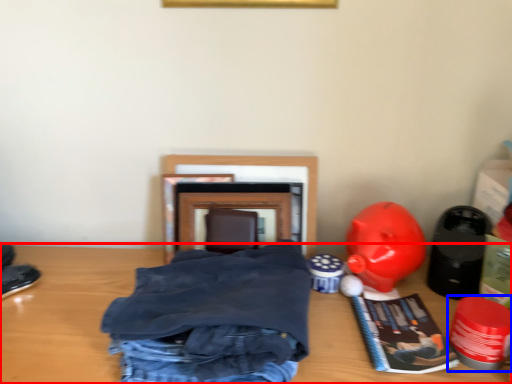
Question: Which object is further to the camera taking this photo, table (highlighted by a red box) or toy (highlighted by a blue box)?

Choices:
 (A) table
 (B) toy

Answer: (A)